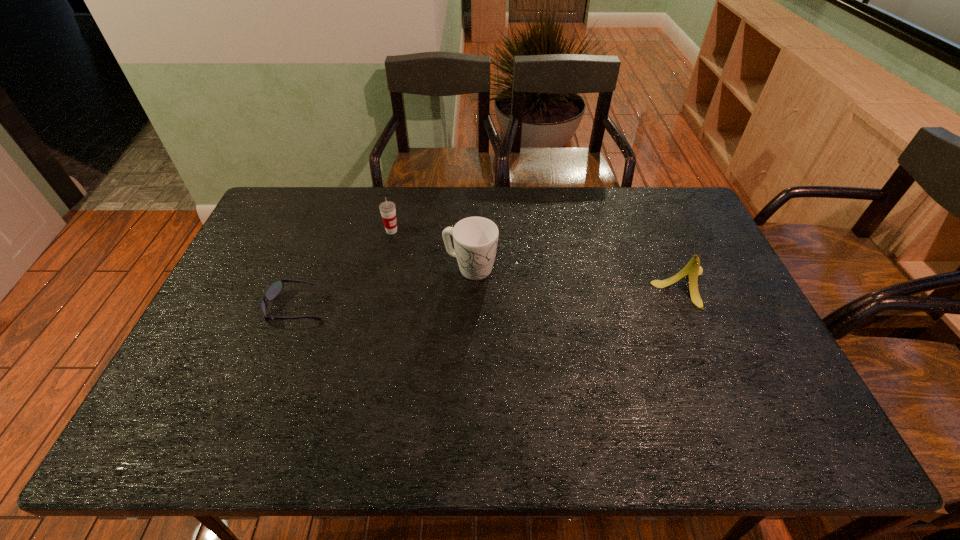
This screenshot has width=960, height=540. In order to click on free area in between the rightmost object and the farthest object in this screenshot , I will do `click(537, 259)`.

Where is `vacant space that is in between the shortest object and the cup`? This screenshot has height=540, width=960. vacant space that is in between the shortest object and the cup is located at coordinates [345, 269].

Where is `vacant area between the sunglasses and the rightmost object`? This screenshot has height=540, width=960. vacant area between the sunglasses and the rightmost object is located at coordinates coord(490,297).

Where is `empty space between the second object from right to left and the leftmost object`? The height and width of the screenshot is (540, 960). empty space between the second object from right to left and the leftmost object is located at coordinates (384, 288).

You are a GUI agent. You are given a task and a screenshot of the screen. Output one action in this format:
    pyautogui.click(x=<x>, y=<y>)
    Task: Click on the vacant point located between the cup and the rightmost object
    This screenshot has width=960, height=540.
    Given the screenshot: What is the action you would take?
    pyautogui.click(x=537, y=259)

Identify the location of free point between the banana and the third object from left to right. This screenshot has height=540, width=960. (576, 278).

Locate an element on the screen. The height and width of the screenshot is (540, 960). vacant area between the third object from right to left and the rightmost object is located at coordinates [537, 259].

Find the location of a particular element. This screenshot has width=960, height=540. free space between the banana and the mug is located at coordinates (576, 278).

Locate an element on the screen. This screenshot has width=960, height=540. free space that is in between the leftmost object and the banana is located at coordinates (490, 297).

You are a GUI agent. You are given a task and a screenshot of the screen. Output one action in this format:
    pyautogui.click(x=<x>, y=<y>)
    Task: Click on the vacant area that lies between the cup and the shortest object
    The image size is (960, 540).
    Given the screenshot: What is the action you would take?
    pyautogui.click(x=345, y=269)